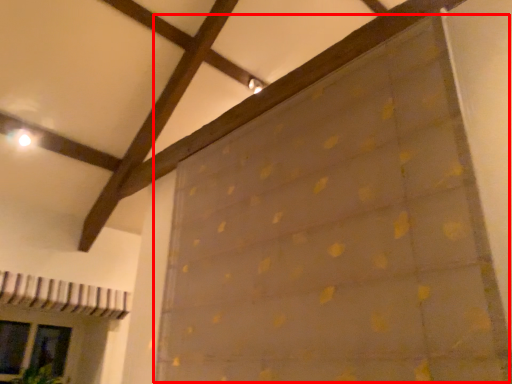
Question: In this image, where is curtain (annotated by the red box) located relative to glass door?

Choices:
 (A) right
 (B) left

Answer: (A)